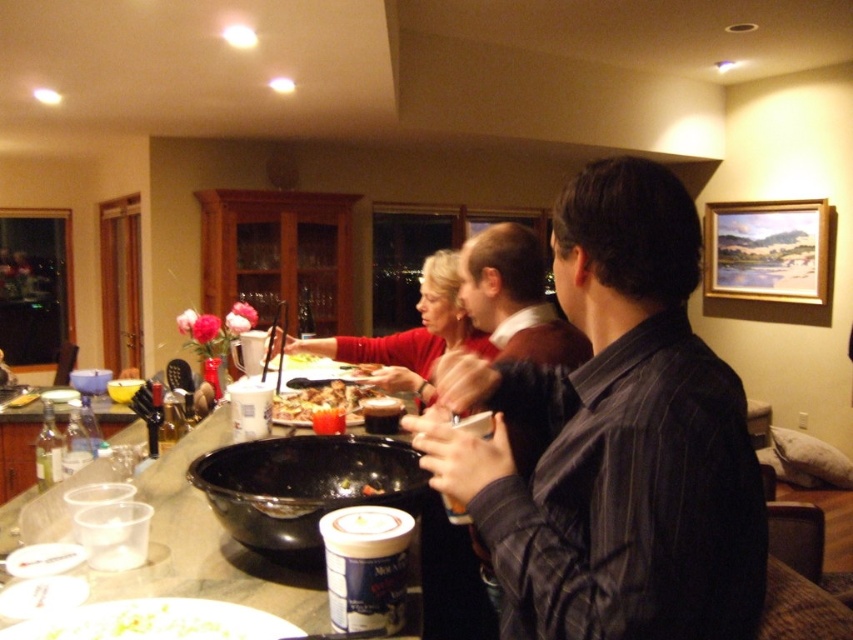
Question: Can you confirm if shiny plastic cup at center is wider than clear glass bottle at counter left?

Choices:
 (A) yes
 (B) no

Answer: (A)

Question: From the image, what is the correct spatial relationship of dark gray shirt at center in relation to black glossy bowl at center?

Choices:
 (A) above
 (B) below

Answer: (A)

Question: Which is farther from the matte red sweater at center?

Choices:
 (A) shiny plastic cup at center
 (B) black glossy bowl at center
 (C) dark gray shirt at center
 (D) clear glass bottle at counter left

Answer: (D)

Question: Among these objects, which one is nearest to the camera?

Choices:
 (A) dark gray striped shirt at center
 (B) clear glass bottle at counter left
 (C) shiny plastic cup at center
 (D) black glossy bowl at center

Answer: (A)

Question: Can you confirm if black glossy bowl at center is smaller than clear glass bottle at counter left?

Choices:
 (A) yes
 (B) no

Answer: (B)

Question: Which point appears closest to the camera in this image?

Choices:
 (A) (596, 538)
 (B) (363, 342)
 (C) (276, 413)

Answer: (A)